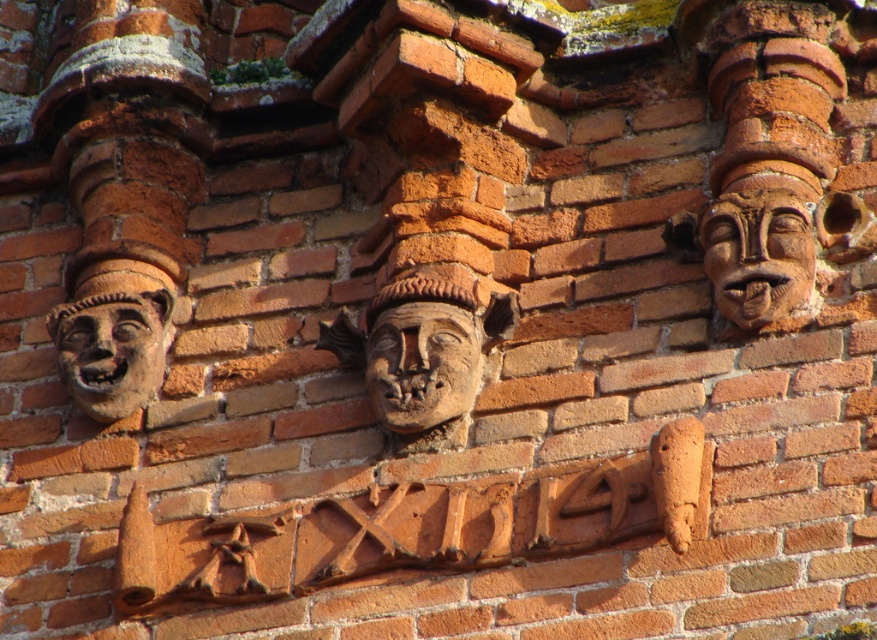
Question: Observing the image, what is the correct spatial positioning of brown stone face at center in reference to matte terracotta face at right?

Choices:
 (A) right
 (B) left

Answer: (B)

Question: Which point is farther to the camera?

Choices:
 (A) (706, 234)
 (B) (464, 397)
 (C) (146, 360)
 (D) (400, 365)

Answer: (C)

Question: Is matte terracotta face at right smaller than matte terracotta face at center?

Choices:
 (A) yes
 (B) no

Answer: (B)

Question: Which of the following is the closest to the observer?

Choices:
 (A) matte terracotta face at center
 (B) brown stone face at center
 (C) matte terracotta face at right
 (D) matte terracotta face at left

Answer: (C)

Question: Which object is closer to the camera taking this photo?

Choices:
 (A) brown stone face at center
 (B) matte terracotta face at left
 (C) matte terracotta face at right

Answer: (C)

Question: Is matte terracotta face at right in front of matte terracotta face at center?

Choices:
 (A) yes
 (B) no

Answer: (A)